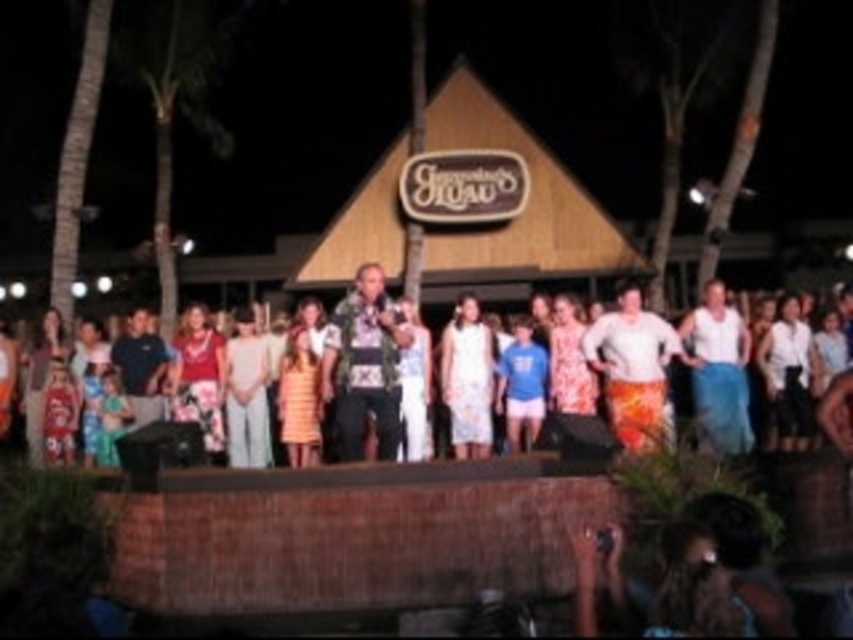
Is camouflage fabric shirt at center below white woven fabric at center?

Indeed, camouflage fabric shirt at center is positioned under white woven fabric at center.

Is point (369, 356) closer to camera compared to point (616, 404)?

Yes, it is in front of point (616, 404).

Image resolution: width=853 pixels, height=640 pixels. Identify the location of camouflage fabric shirt at center. (364, 364).

Is green leafy palm tree at left taller than white woven fabric at center?

Yes.

The height and width of the screenshot is (640, 853). What are the coordinates of `green leafy palm tree at left` in the screenshot? It's located at (173, 100).

From the picture: Who is positioned more to the left, camouflage fabric shirt at center or floral dress at center?

Positioned to the left is camouflage fabric shirt at center.

Is camouflage fabric shirt at center above floral dress at center?

No, camouflage fabric shirt at center is not above floral dress at center.

Is point (358, 282) more distant than point (753, 387)?

That is False.

Find the location of a particular element. Image resolution: width=853 pixels, height=640 pixels. camouflage fabric shirt at center is located at coordinates (364, 364).